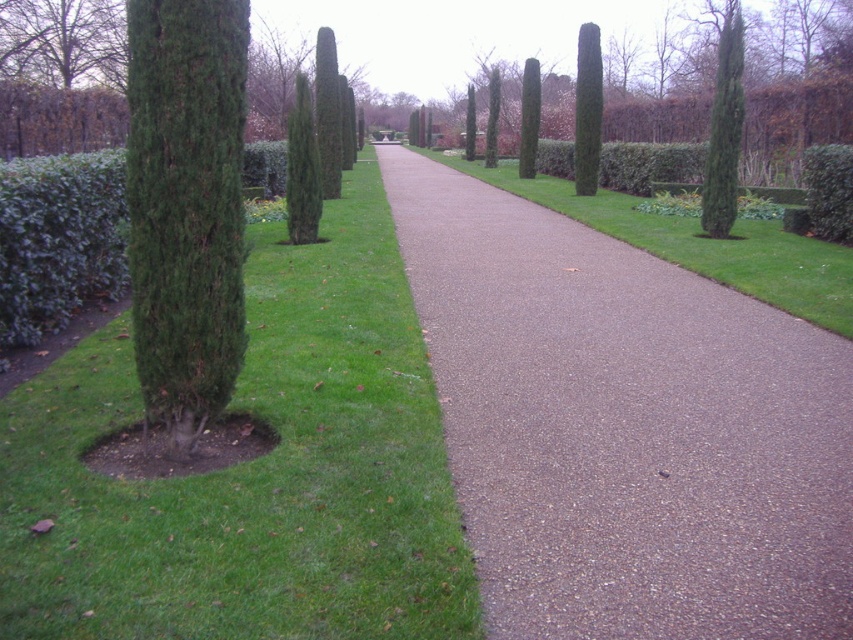
You are standing at the entrance of the garden and want to walk towards the green leafy hedge at left. Which direction should you head?

The green leafy hedge at left is located at point (57,240), so you should head to the left to reach it.

You are a gardener planning to plant a new shrub between the green textured cypress at left and the green leafy hedge at left. Based on their positions, which one should you place the new shrub closer to in order to maintain the garden symmetry?

The green textured cypress at left is below the green leafy hedge at left, so to maintain symmetry, the new shrub should be placed closer to the green textured cypress at left to align with the lower position.

You are a gardener planning to plant a new tree in the garden. You have two options from the image, the green textured cypress at left and the green textured tree at upper left. Which tree requires more space due to its size?

The green textured cypress at left requires more space because it is larger in size than the green textured tree at upper left.